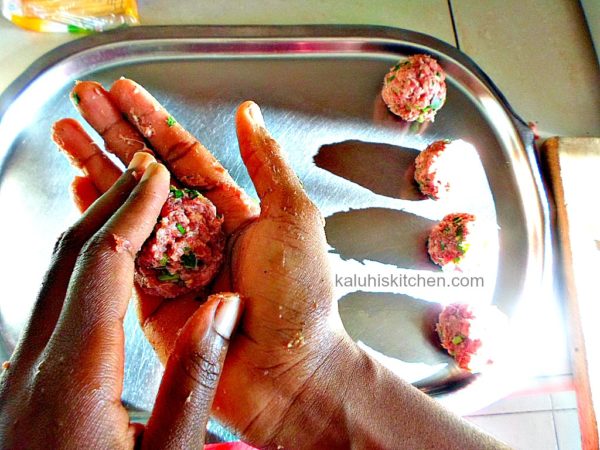
You are a GUI agent. You are given a task and a screenshot of the screen. Output one action in this format:
    pyautogui.click(x=<x>, y=<y>)
    Task: Click on the counter
    
    Given the screenshot: What is the action you would take?
    pyautogui.click(x=567, y=155)